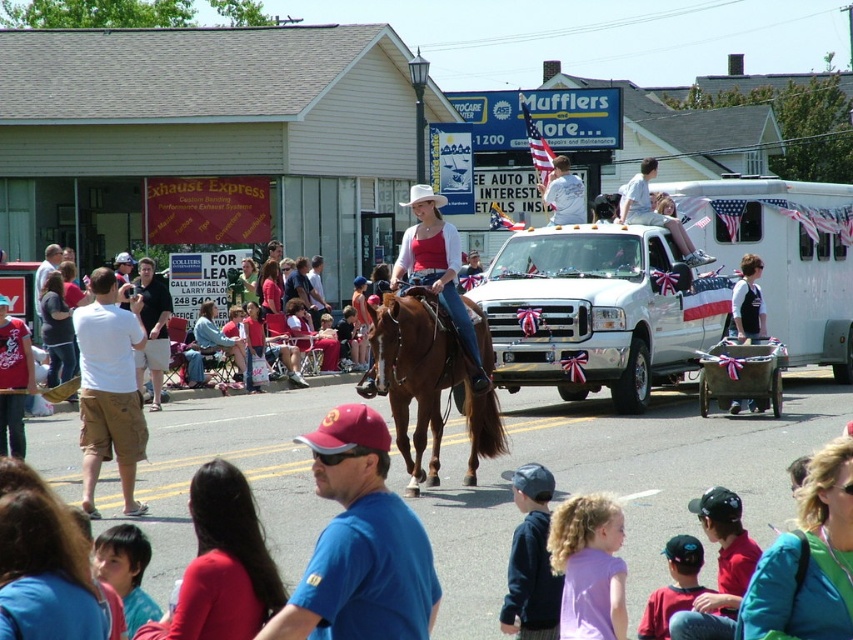
You are a photographer standing at the edge of the crowd. You want to take a photo that includes both the blue fabric shirt at center and the brown glossy horse at center. Which object should you focus on first if you want to ensure both are in the frame?

The blue fabric shirt at center has a lesser height compared to the brown glossy horse at center, so you should focus on the brown glossy horse at center first to ensure both are in the frame.

You are a photographer trying to capture a photo of the brown glossy horse at center and the white cotton shirt at left. Which object should you focus on first if you want to include both in your frame without zooming?

The brown glossy horse at center is wider than the white cotton shirt at left, so you should focus on the brown glossy horse at center first to ensure it fits in the frame before adjusting for the narrower white cotton shirt at left.